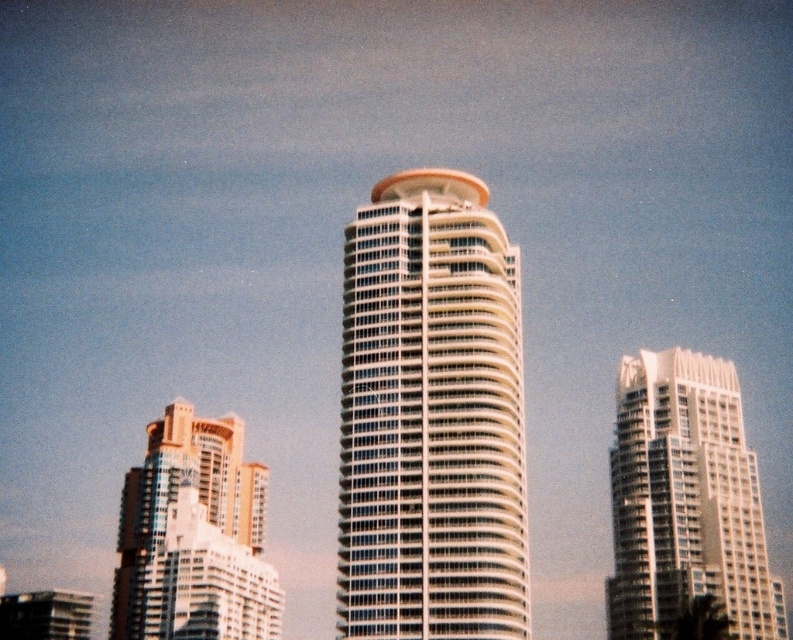
Question: Considering the relative positions of white glass building at center and white glass building at right in the image provided, where is white glass building at center located with respect to white glass building at right?

Choices:
 (A) below
 (B) above

Answer: (B)

Question: Can you confirm if white glass building at right is smaller than matte glass building at lower left?

Choices:
 (A) no
 (B) yes

Answer: (A)

Question: Does white glass building at center have a larger size compared to gold metallic building at left?

Choices:
 (A) no
 (B) yes

Answer: (A)

Question: Which point is farther to the camera?

Choices:
 (A) white glass building at right
 (B) gold metallic building at left

Answer: (B)

Question: Which object is closer to the camera taking this photo?

Choices:
 (A) white glass building at center
 (B) gold metallic building at left
 (C) matte glass building at lower left

Answer: (A)

Question: Which point appears closest to the camera in this image?

Choices:
 (A) (343, 253)
 (B) (613, 496)
 (C) (63, 634)

Answer: (B)